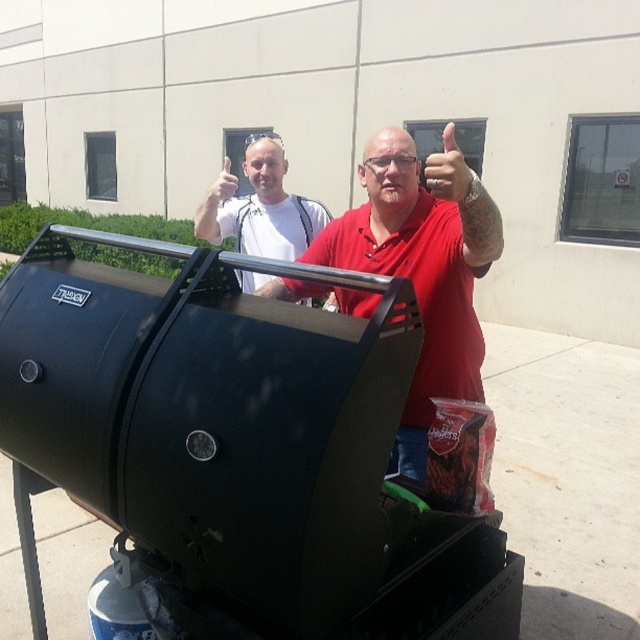
Who is taller, matte red shirt at center or white matte t-shirt at upper left?

matte red shirt at center

This screenshot has height=640, width=640. I want to click on matte red shirt at center, so click(x=419, y=275).

Image resolution: width=640 pixels, height=640 pixels. What are the coordinates of `matte red shirt at center` in the screenshot? It's located at (419, 275).

Locate an element on the screen. This screenshot has height=640, width=640. matte black hand at upper center is located at coordinates (449, 170).

Can you confirm if matte black hand at upper center is positioned to the left of matte white hand at upper center?

In fact, matte black hand at upper center is to the right of matte white hand at upper center.

At what (x,y) coordinates should I click in order to perform the action: click on matte black hand at upper center. Please return your answer as a coordinate pair (x, y). Image resolution: width=640 pixels, height=640 pixels. Looking at the image, I should click on (449, 170).

Can you confirm if matte red shirt at center is shorter than matte white hand at upper center?

No.

Measure the distance from matte red shirt at center to matte white hand at upper center.

The distance of matte red shirt at center from matte white hand at upper center is 4.02 feet.

Identify the location of matte red shirt at center. (419, 275).